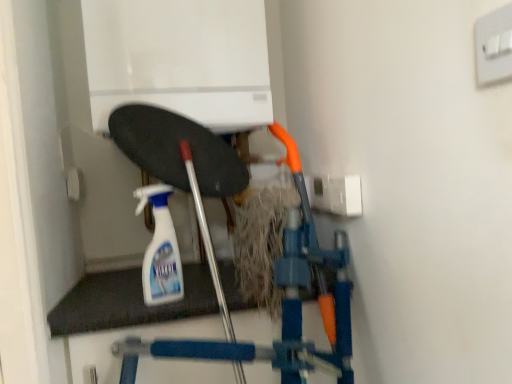
What is the approximate width of clear plastic spray bottle at center?

The width of clear plastic spray bottle at center is 1.88 inches.

The image size is (512, 384). What do you see at coordinates (160, 250) in the screenshot? I see `clear plastic spray bottle at center` at bounding box center [160, 250].

You are a GUI agent. You are given a task and a screenshot of the screen. Output one action in this format:
    pyautogui.click(x=<x>, y=<y>)
    Task: Click on the clear plastic spray bottle at center
    The width and height of the screenshot is (512, 384).
    Given the screenshot: What is the action you would take?
    pyautogui.click(x=160, y=250)

Measure the distance between point (161,223) and camera.

Point (161,223) is 37.40 inches away from camera.

What are the coordinates of `clear plastic spray bottle at center` in the screenshot? It's located at (160, 250).